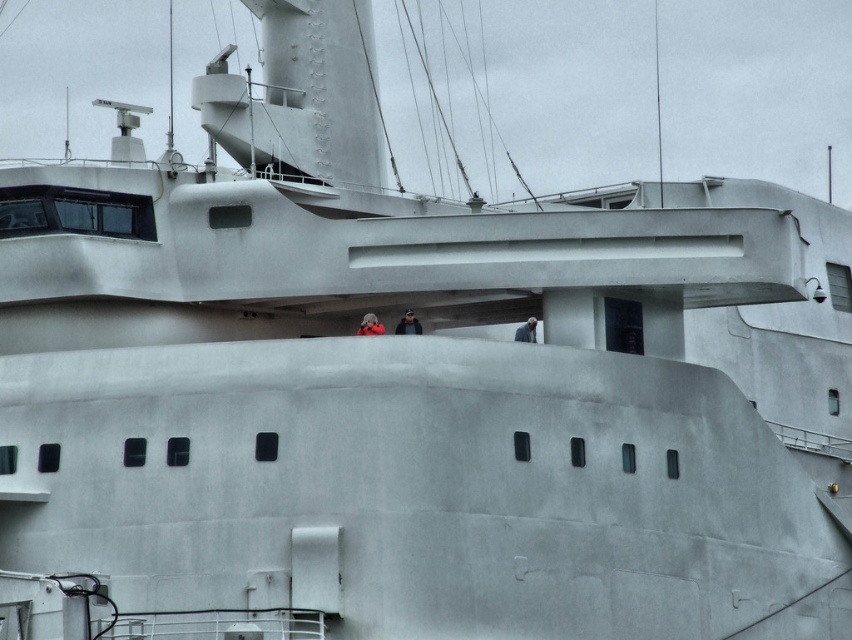
You are on the deck of the ship and need to locate the red fabric person at center. According to the coordinates provided, where should you look?

The red fabric person at center is located at coordinates point (369, 324).

You are a photographer on the ship and want to capture both the dark gray fabric jacket at center and the red fabric person at center in the same photo. Which one should you focus on first to ensure both are in frame?

You should focus on the dark gray fabric jacket at center first because the red fabric person at center is behind it, so adjusting the framing to include both would require ensuring the jacket is positioned to allow the person behind to be visible.

You are a photographer on the ship and want to position yourself exactly where the dark gray fabric jacket at center is located. What are the coordinates of that location?

The coordinates of the dark gray fabric jacket at center are at point (x=407, y=324).